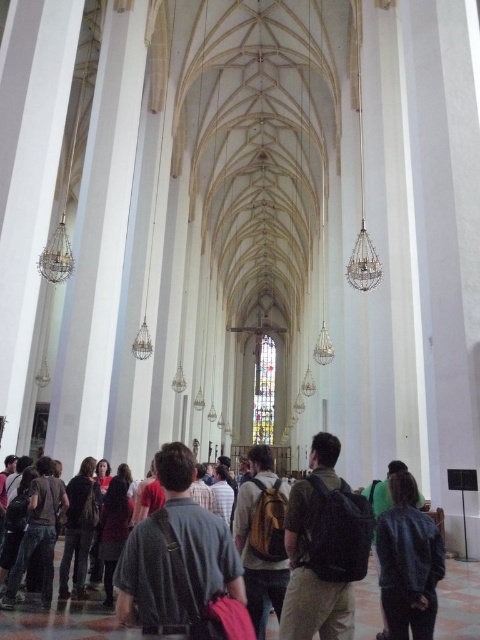
Does dark gray backpack at center have a larger size compared to dark brown leather jacket at center?

Yes.

Does dark gray backpack at center lie in front of dark brown leather jacket at center?

Yes, it is.

This screenshot has height=640, width=480. In order to click on dark gray backpack at center in this screenshot , I will do `click(197, 531)`.

The width and height of the screenshot is (480, 640). Find the location of `dark gray backpack at center`. dark gray backpack at center is located at coordinates (197, 531).

Between dark brown leather jacket at center and stained glass window at center, which one is positioned lower?

Positioned lower is stained glass window at center.

Which is behind, point (113, 524) or point (263, 408)?

Point (263, 408)

Based on the photo, who is more forward, (110, 573) or (266, 426)?

Point (110, 573) is in front.

Identify the location of dark brown leather jacket at center. The width and height of the screenshot is (480, 640). (112, 531).

Can you confirm if denim jacket at lower right is positioned above yellow canvas backpack at center?

Yes.

Which is below, denim jacket at lower right or yellow canvas backpack at center?

yellow canvas backpack at center is below.

Find the location of a particular element. The height and width of the screenshot is (640, 480). denim jacket at lower right is located at coordinates (408, 563).